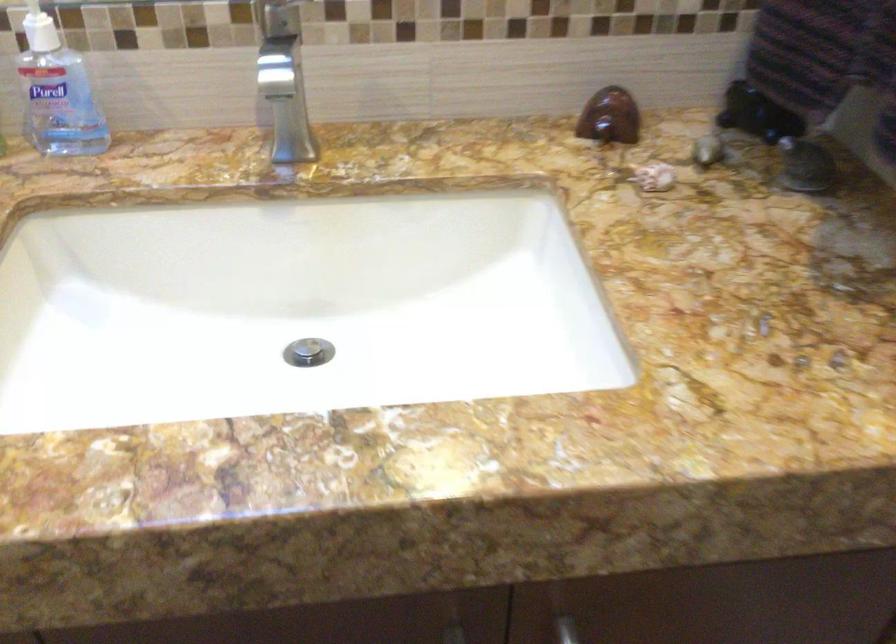
Identify the location of brown decorative object. This screenshot has width=896, height=644. (609, 117).